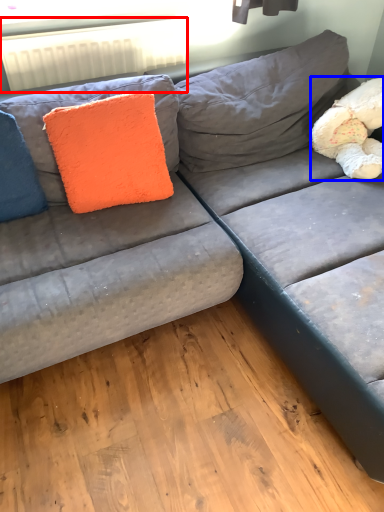
Question: Which object appears closest to the camera in this image, radiator (highlighted by a red box) or teddy (highlighted by a blue box)?

Choices:
 (A) radiator
 (B) teddy

Answer: (B)